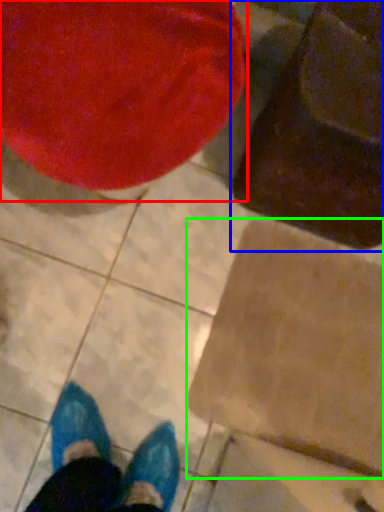
Question: Which object is positioned farthest from bean bag chair (highlighted by a red box)? Select from bean bag chair (highlighted by a blue box) and cardboard box (highlighted by a green box).

Choices:
 (A) bean bag chair
 (B) cardboard box

Answer: (B)